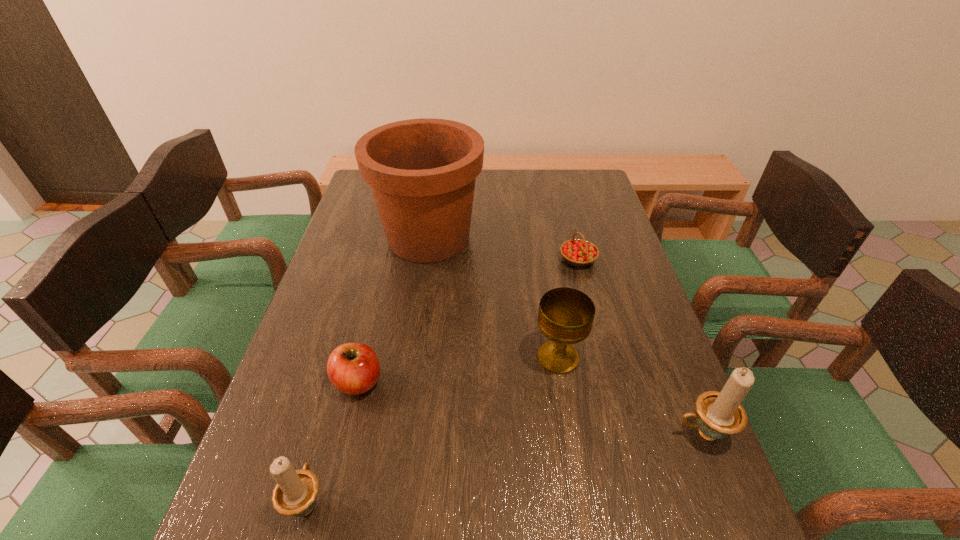
Please determine a free point for an extra candle_holder to ensure balance. Please provide its 2D coordinates. Your answer should be formatted as a tuple, i.e. [(x, y)], where the tuple contains the x and y coordinates of a point satisfying the conditions above.

[(516, 466)]